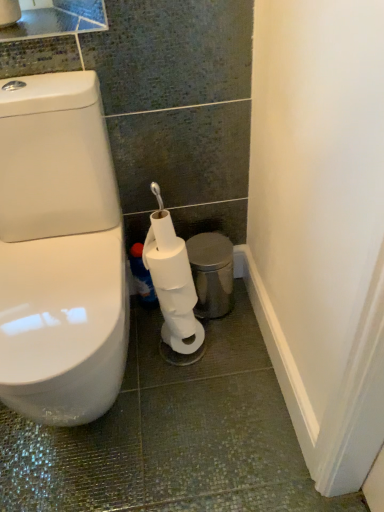
Question: From their relative heights in the image, would you say white matte toilet paper at lower center is taller or shorter than metallic silver trash can at lower right?

Choices:
 (A) tall
 (B) short

Answer: (A)

Question: From the image's perspective, is white matte toilet paper at lower center above or below metallic silver trash can at lower right?

Choices:
 (A) below
 (B) above

Answer: (A)

Question: Estimate the real-world distances between objects in this image. Which object is closer to the metallic silver trash can at lower right?

Choices:
 (A) blue glossy bottle at lower center
 (B) white matte toilet paper at lower center

Answer: (B)

Question: Considering the real-world distances, which object is farthest from the blue glossy bottle at lower center?

Choices:
 (A) white matte toilet paper at lower center
 (B) metallic silver trash can at lower right

Answer: (A)